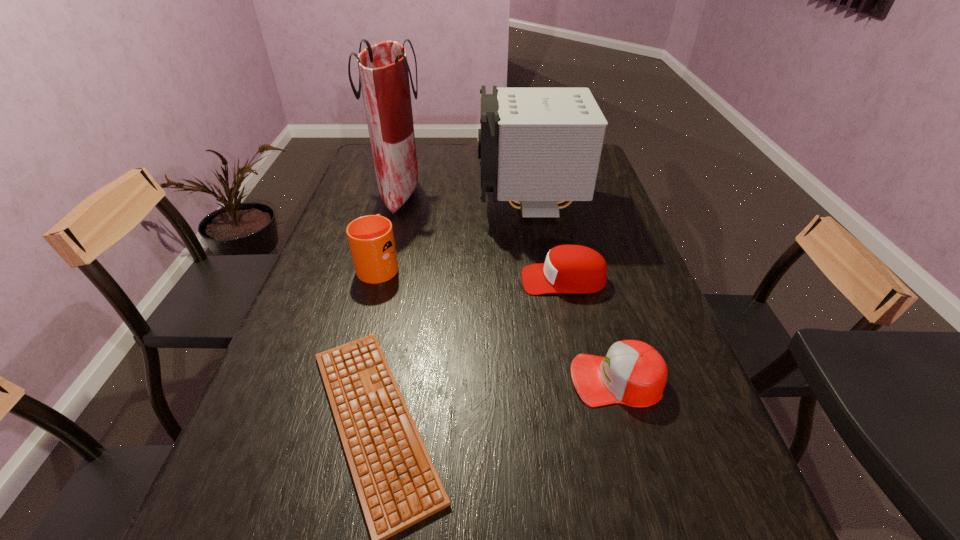
Find the location of a particular element. object positioned at the far left corner is located at coordinates (383, 69).

Identify the location of vacant space at the far edge of the desktop. The width and height of the screenshot is (960, 540). (449, 168).

The image size is (960, 540). What are the coordinates of `free space at the left edge of the desktop` in the screenshot? It's located at click(267, 415).

This screenshot has width=960, height=540. Identify the location of free space at the right edge of the desktop. (645, 284).

The width and height of the screenshot is (960, 540). In order to click on unoccupied area between the tallest object and the fifth shortest object in this screenshot , I will do `click(465, 199)`.

Identify the location of vacant space that's between the nearer baseball cap and the mug. (497, 322).

The width and height of the screenshot is (960, 540). What are the coordinates of `unoccupied position between the fourth shortest object and the fan` in the screenshot? It's located at (454, 235).

Identify the location of free space between the farther baseball cap and the second tallest object. The height and width of the screenshot is (540, 960). (546, 243).

The height and width of the screenshot is (540, 960). I want to click on empty space that is in between the mug and the fifth shortest object, so click(454, 235).

Locate an element on the screen. This screenshot has height=540, width=960. object that stands as the third closest to the computer keyboard is located at coordinates (633, 373).